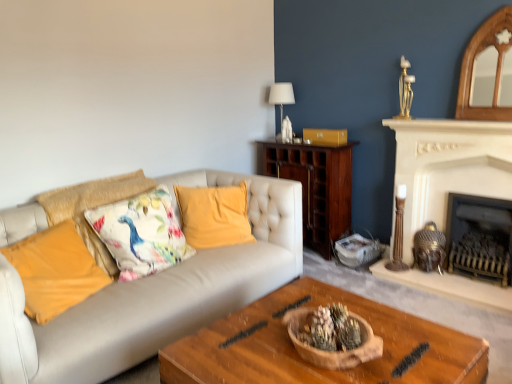
Question: Looking at their shapes, would you say yellow fabric pillow at left, the fourth pillow positioned from the right, is wider or thinner than floral fabric cushion at center left, the 2th pillow viewed from the right?

Choices:
 (A) wide
 (B) thin

Answer: (B)

Question: Is yellow fabric pillow at left, arranged as the 1th pillow when viewed from the left, inside or outside of floral fabric cushion at center left, the 3th pillow in the left-to-right sequence?

Choices:
 (A) inside
 (B) outside

Answer: (B)

Question: Which of these objects is positioned farthest from the floral fabric cushion at center left, the 3th pillow in the left-to-right sequence?

Choices:
 (A) white fabric lampshade at upper center
 (B) yellow velvet pillow at center, which ranks as the first pillow in right-to-left order
 (C) black metal fireplace at right, acting as the first fireplace starting from the right
 (D) wooden coffee table at center
 (E) dark wood cabinet at center

Answer: (C)

Question: Considering the real-world distances, which object is closest to the white fabric lampshade at upper center?

Choices:
 (A) dark wood cabinet at center
 (B) floral fabric cushion at left, which is the second pillow in left-to-right order
 (C) wooden coffee table at center
 (D) yellow fabric pillow at left, arranged as the 1th pillow when viewed from the left
 (E) floral fabric cushion at center left, the 2th pillow viewed from the right

Answer: (A)